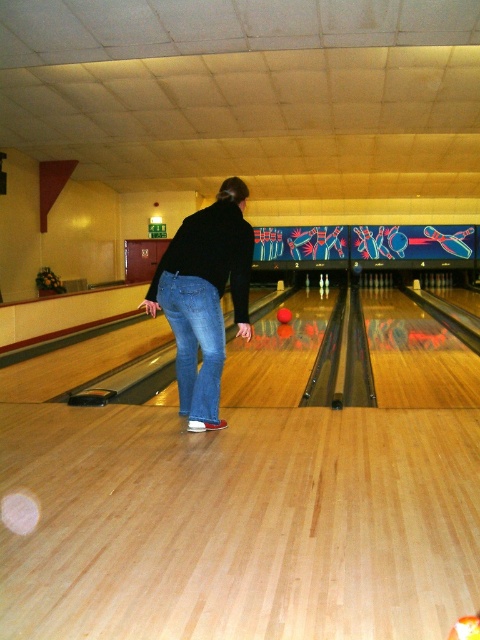
You are standing at the entrance of the bowling alley and see the point marked at coordinates (204, 298). What object is located at that point?

The point at coordinates (204, 298) corresponds to the jeans at center.